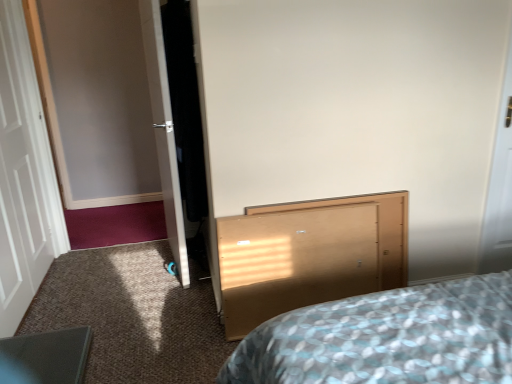
Question: Is white wooden door at left, which ranks as the second door in right-to-left order, facing towards white glossy door at left, the first door from the right?

Choices:
 (A) no
 (B) yes

Answer: (B)

Question: Is white wooden door at left, arranged as the 1th door when viewed from the left, looking in the opposite direction of white glossy door at left, the first door from the right?

Choices:
 (A) no
 (B) yes

Answer: (B)

Question: Is white wooden door at left, arranged as the 1th door when viewed from the left, surrounding white glossy door at left, which appears as the 2th door when viewed from the left?

Choices:
 (A) no
 (B) yes

Answer: (A)

Question: Is white wooden door at left, which ranks as the second door in right-to-left order, at the left side of white glossy door at left, which appears as the 2th door when viewed from the left?

Choices:
 (A) yes
 (B) no

Answer: (A)

Question: Is white wooden door at left, arranged as the 1th door when viewed from the left, shorter than white glossy door at left, which appears as the 2th door when viewed from the left?

Choices:
 (A) no
 (B) yes

Answer: (A)

Question: Is point (161, 97) positioned closer to the camera than point (322, 253)?

Choices:
 (A) farther
 (B) closer

Answer: (A)

Question: Based on their positions, is white glossy door at left, the first door from the right, located to the left or right of light wood vanity at center?

Choices:
 (A) right
 (B) left

Answer: (B)

Question: Is white glossy door at left, which appears as the 2th door when viewed from the left, wider or thinner than light wood vanity at center?

Choices:
 (A) wide
 (B) thin

Answer: (A)

Question: Which is correct: white glossy door at left, which appears as the 2th door when viewed from the left, is inside light wood vanity at center, or outside of it?

Choices:
 (A) inside
 (B) outside

Answer: (B)

Question: Considering the positions of white wooden door at left, arranged as the 1th door when viewed from the left, and white glossy door at left, the first door from the right, in the image, is white wooden door at left, arranged as the 1th door when viewed from the left, taller or shorter than white glossy door at left, the first door from the right,?

Choices:
 (A) tall
 (B) short

Answer: (A)

Question: Considering the positions of white wooden door at left, arranged as the 1th door when viewed from the left, and white glossy door at left, which appears as the 2th door when viewed from the left, in the image, is white wooden door at left, arranged as the 1th door when viewed from the left, wider or thinner than white glossy door at left, which appears as the 2th door when viewed from the left,?

Choices:
 (A) wide
 (B) thin

Answer: (B)

Question: In the image, is white wooden door at left, arranged as the 1th door when viewed from the left, on the left side or the right side of white glossy door at left, the first door from the right?

Choices:
 (A) left
 (B) right

Answer: (A)

Question: Is point (1, 56) closer or farther from the camera than point (162, 87)?

Choices:
 (A) closer
 (B) farther

Answer: (B)

Question: Would you say light wood vanity at center is to the left or to the right of white glossy door at left, the first door from the right, in the picture?

Choices:
 (A) left
 (B) right

Answer: (B)

Question: From a real-world perspective, is light wood vanity at center positioned above or below white glossy door at left, which appears as the 2th door when viewed from the left?

Choices:
 (A) above
 (B) below

Answer: (B)